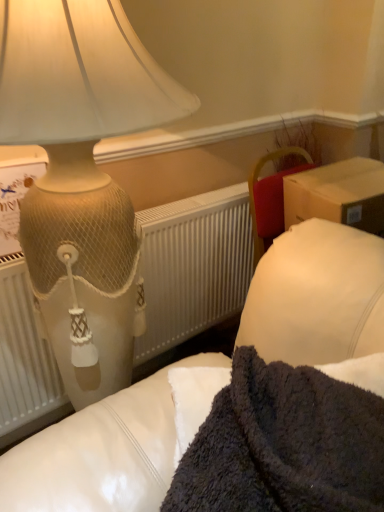
Question: Can you confirm if white textured radiator at left is smaller than matte cream lamp at upper left?

Choices:
 (A) no
 (B) yes

Answer: (B)

Question: Is white textured radiator at left at the left side of matte cream lamp at upper left?

Choices:
 (A) no
 (B) yes

Answer: (A)

Question: Is white textured radiator at left shorter than matte cream lamp at upper left?

Choices:
 (A) no
 (B) yes

Answer: (B)

Question: Is white textured radiator at left positioned beyond the bounds of matte cream lamp at upper left?

Choices:
 (A) yes
 (B) no

Answer: (B)

Question: From the image's perspective, is white textured radiator at left over matte cream lamp at upper left?

Choices:
 (A) no
 (B) yes

Answer: (A)

Question: Which is correct: matte cream lamp at upper left is inside dark fuzzy blanket at lower right, or outside of it?

Choices:
 (A) inside
 (B) outside

Answer: (B)

Question: Visually, is matte cream lamp at upper left positioned to the left or to the right of dark fuzzy blanket at lower right?

Choices:
 (A) right
 (B) left

Answer: (B)

Question: From a real-world perspective, is matte cream lamp at upper left above or below dark fuzzy blanket at lower right?

Choices:
 (A) below
 (B) above

Answer: (B)

Question: Considering the positions of point (23, 41) and point (314, 452), is point (23, 41) closer or farther from the camera than point (314, 452)?

Choices:
 (A) closer
 (B) farther

Answer: (B)

Question: From a real-world perspective, is white textured radiator at left positioned above or below matte cream lamp at upper left?

Choices:
 (A) below
 (B) above

Answer: (A)

Question: Is white textured radiator at left inside or outside of matte cream lamp at upper left?

Choices:
 (A) inside
 (B) outside

Answer: (A)

Question: Considering their positions, is white textured radiator at left located in front of or behind matte cream lamp at upper left?

Choices:
 (A) behind
 (B) front

Answer: (A)

Question: From the image's perspective, relative to matte cream lamp at upper left, is white textured radiator at left above or below?

Choices:
 (A) above
 (B) below

Answer: (B)

Question: Do you think dark fuzzy blanket at lower right is within matte cream lamp at upper left, or outside of it?

Choices:
 (A) outside
 (B) inside

Answer: (A)

Question: Does point (271, 480) appear closer or farther from the camera than point (119, 192)?

Choices:
 (A) farther
 (B) closer

Answer: (B)